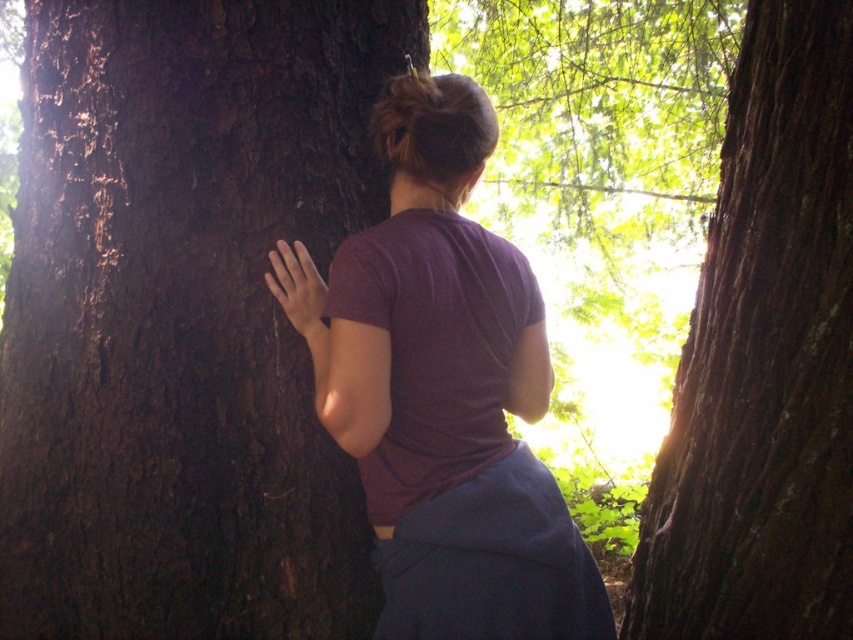
Between dark brown rough tree trunk at left and matte brown hand at left, which one has more height?

Standing taller between the two is dark brown rough tree trunk at left.

The image size is (853, 640). Describe the element at coordinates (183, 317) in the screenshot. I see `dark brown rough tree trunk at left` at that location.

Between point (28, 262) and point (277, 301), which one is positioned behind?

The point (28, 262) is more distant.

The image size is (853, 640). I want to click on dark brown rough tree trunk at left, so click(x=183, y=317).

Between dark brown rough tree trunk at left and purple matte shirt at center, which one is positioned lower?

purple matte shirt at center is lower down.

Is point (141, 600) behind point (430, 572)?

Yes, it is.

Where is `dark brown rough tree trunk at left`? dark brown rough tree trunk at left is located at coordinates click(183, 317).

Between dark brown rough tree trunk at left and dark brown rough tree trunk at center, which one has less height?

Standing shorter between the two is dark brown rough tree trunk at left.

Is dark brown rough tree trunk at left smaller than dark brown rough tree trunk at center?

Actually, dark brown rough tree trunk at left might be larger than dark brown rough tree trunk at center.

This screenshot has height=640, width=853. I want to click on dark brown rough tree trunk at left, so click(183, 317).